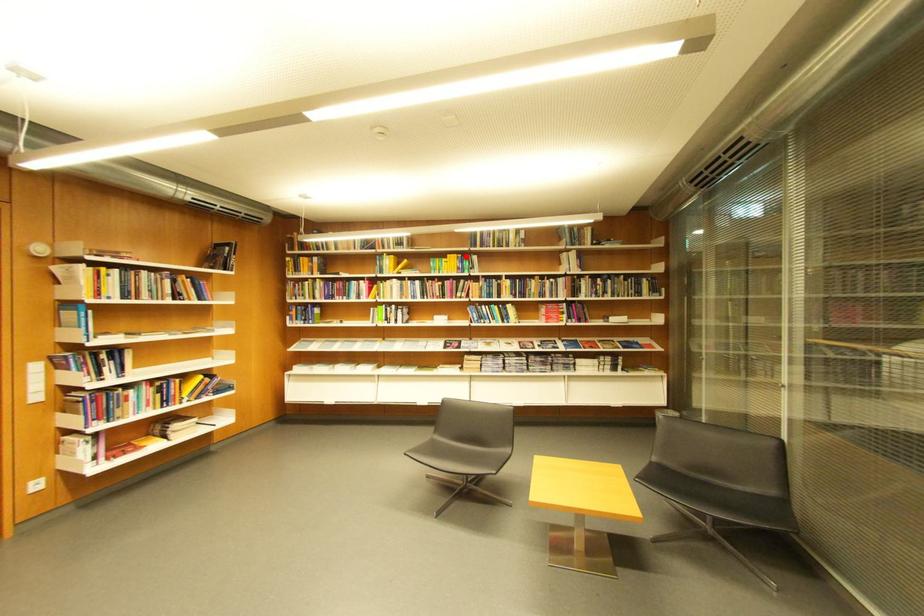
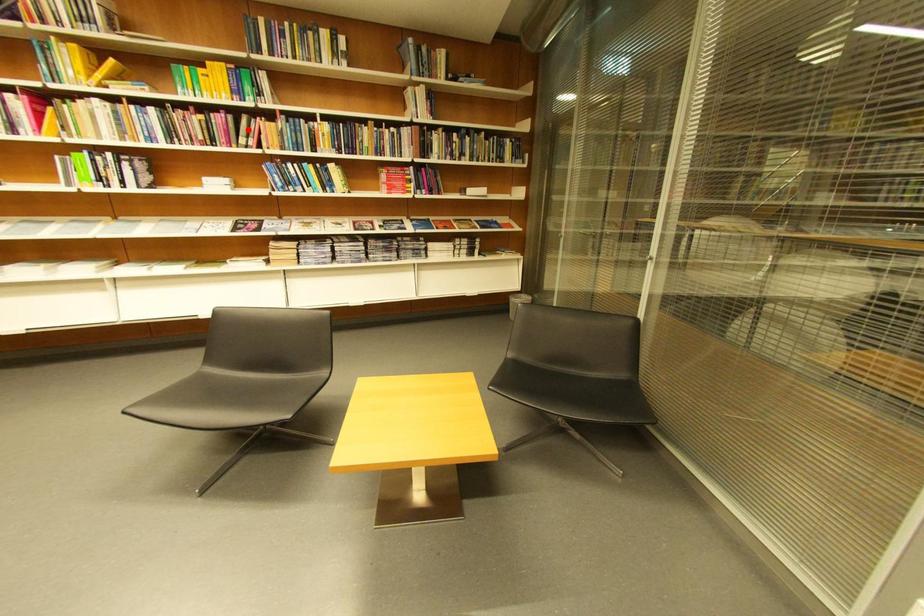
I am providing you with two images of the same scene from different viewpoints. A red point is marked on the first image and another point is marked on the second image. Do the highlighted points in image1 and image2 indicate the same real-world spot?

No